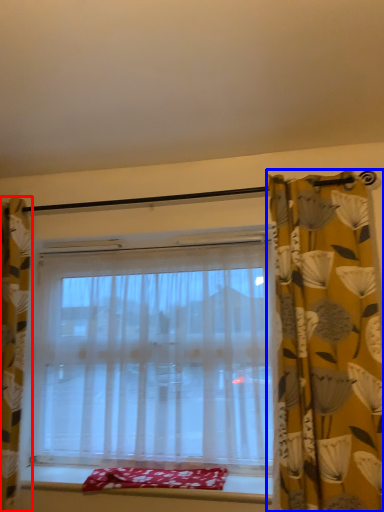
Question: Among these objects, which one is nearest to the camera, curtain (highlighted by a red box) or curtain (highlighted by a blue box)?

Choices:
 (A) curtain
 (B) curtain

Answer: (B)